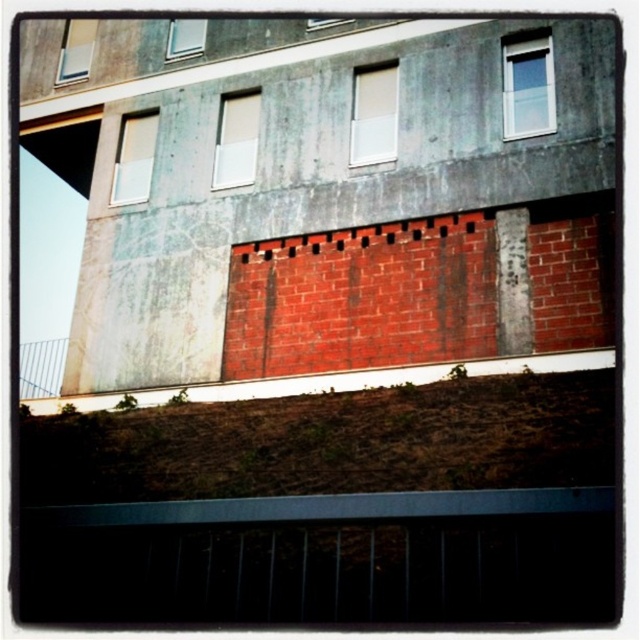
Can you confirm if matte white window at center is wider than matte glass window at upper left?

In fact, matte white window at center might be narrower than matte glass window at upper left.

Is point (237, 164) farther from viewer compared to point (84, 60)?

No, it is in front of (84, 60).

Identify the location of matte white window at center. (236, 141).

Can you confirm if white matte window at upper center is positioned to the right of matte glass window at upper left?

Correct, you'll find white matte window at upper center to the right of matte glass window at upper left.

Is point (380, 67) positioned after point (61, 76)?

That is False.

The height and width of the screenshot is (640, 640). In order to click on white matte window at upper center in this screenshot , I will do `click(372, 116)`.

Can you confirm if brown grass at lower center is wider than white matte window at upper left?

Yes.

Who is more distant from viewer, (570, 388) or (145, 182)?

Positioned behind is point (145, 182).

In the scene shown: Measure the distance between point (52, 564) and camera.

Point (52, 564) is 10.47 meters from camera.

Locate an element on the screen. brown grass at lower center is located at coordinates (328, 508).